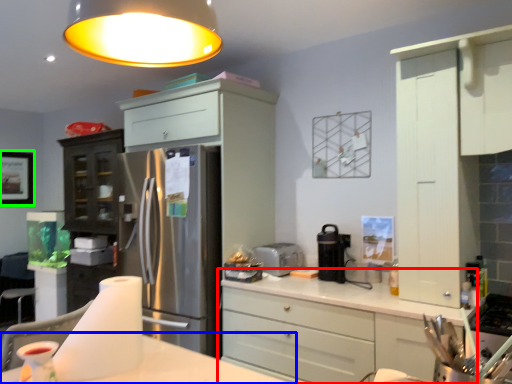
Question: Which is farther away from cabinetry (highlighted by a red box)? table (highlighted by a blue box) or picture frame (highlighted by a green box)?

Choices:
 (A) table
 (B) picture frame

Answer: (B)